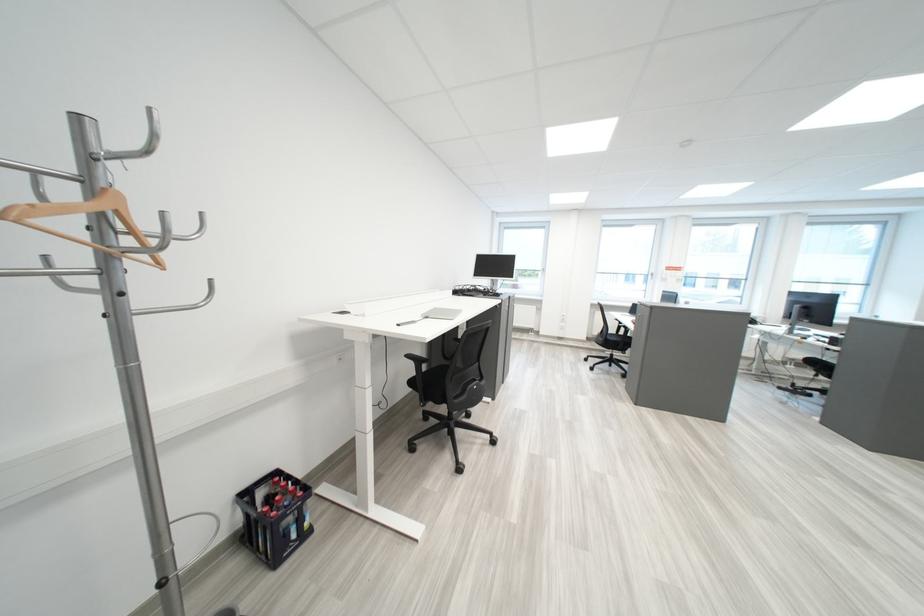
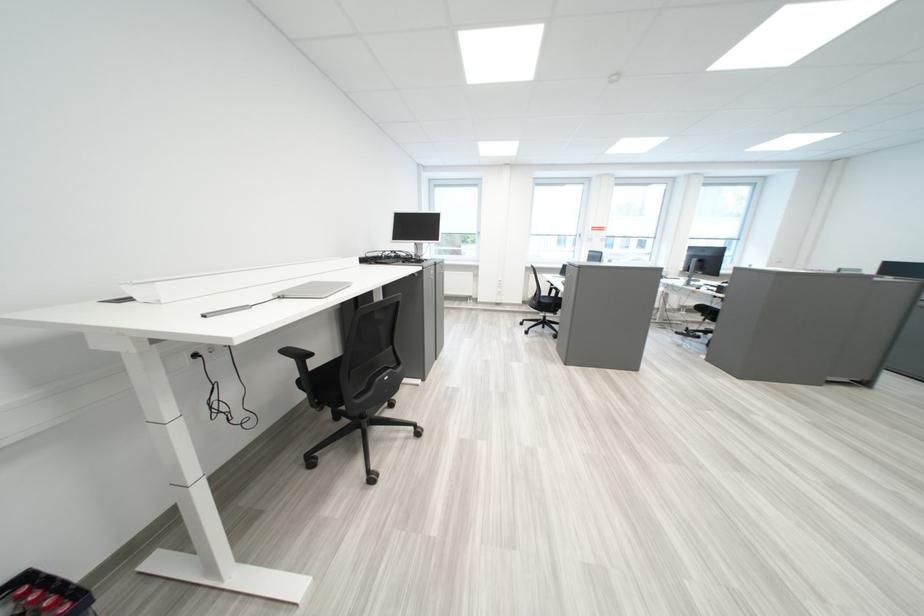
What movement of the cameraman would produce the second image?

The movement direction of the cameraman is right, forward.